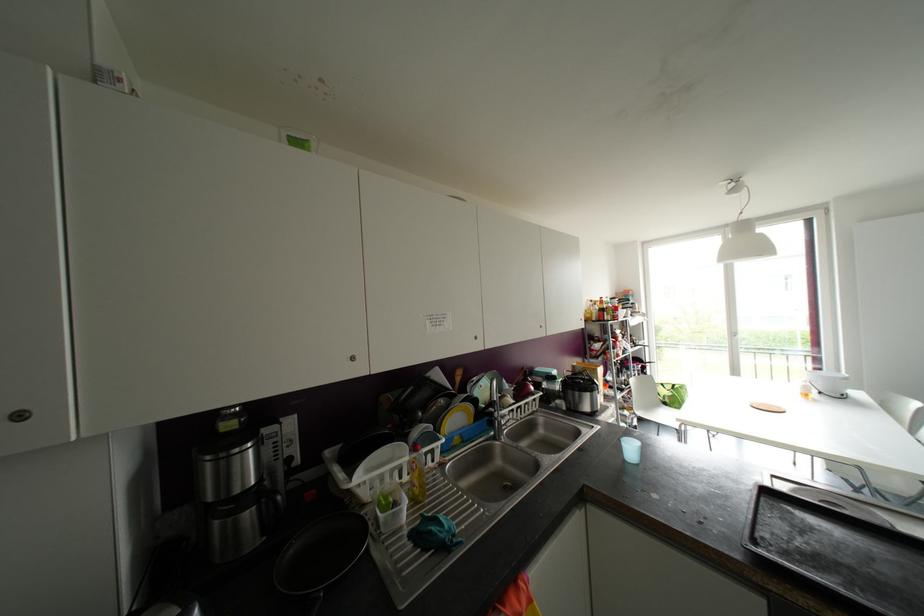
Where is `frying pan handle`? The height and width of the screenshot is (616, 924). frying pan handle is located at coordinates (314, 602).